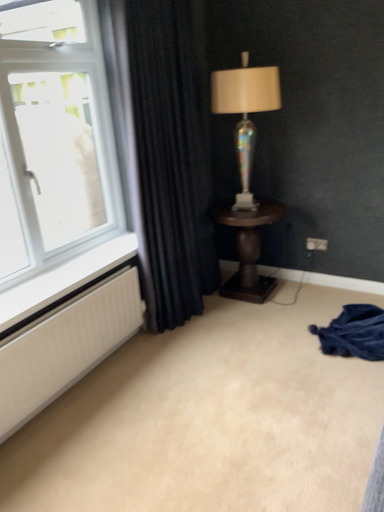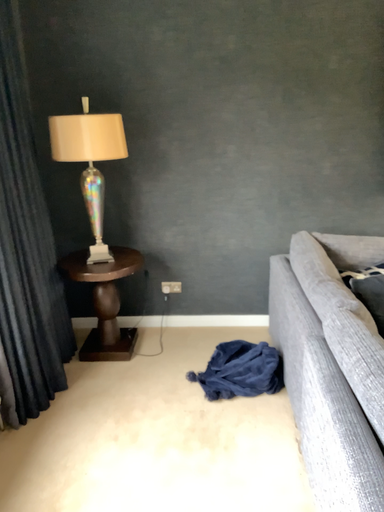
Question: Which way did the camera rotate in the video?

Choices:
 (A) rotated left
 (B) rotated right

Answer: (B)